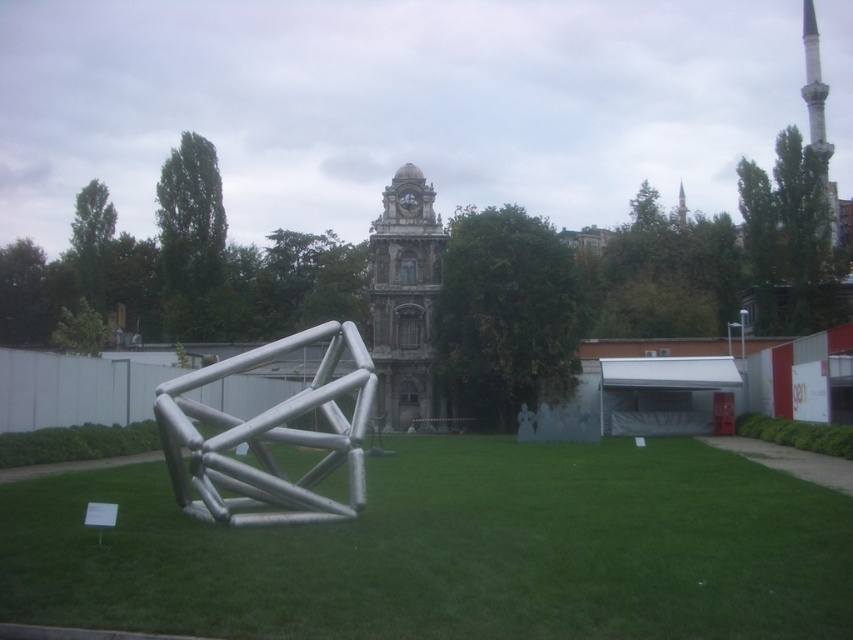
Who is more distant from viewer, [126,476] or [308,520]?

The point [126,476] is more distant.

Who is more forward, (267, 573) or (285, 500)?

Point (267, 573)

The height and width of the screenshot is (640, 853). Identify the location of green grass at center. (454, 552).

Which is in front, point (628, 532) or point (396, 196)?

Point (628, 532) is in front.

The image size is (853, 640). What do you see at coordinates (454, 552) in the screenshot?
I see `green grass at center` at bounding box center [454, 552].

Where is `green grass at center`? Image resolution: width=853 pixels, height=640 pixels. green grass at center is located at coordinates (454, 552).

In the scene shown: Who is positioned more to the right, silver metallic structure at center or stone clock tower at center?

From the viewer's perspective, stone clock tower at center appears more on the right side.

Between point (219, 371) and point (419, 232), which one is positioned behind?

The point (419, 232) is behind.

Where is `silver metallic structure at center`? This screenshot has width=853, height=640. silver metallic structure at center is located at coordinates (270, 435).